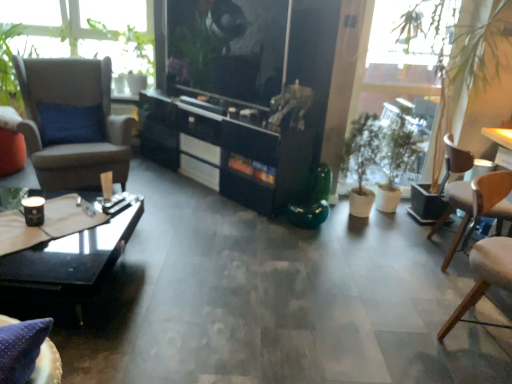
Question: Considering the positions of point (53, 299) and point (386, 185), is point (53, 299) closer or farther from the camera than point (386, 185)?

Choices:
 (A) closer
 (B) farther

Answer: (A)

Question: Do you think black glass coffee table at lower left is within green matte plant at right, or outside of it?

Choices:
 (A) inside
 (B) outside

Answer: (B)

Question: Which object is the closest to the black glossy cabinet at center?

Choices:
 (A) brown leather armchair at left, placed as the 2th chair when sorted from right to left
 (B) light brown wooden chair at right, placed as the 2th chair when sorted from left to right
 (C) green matte plant at right
 (D) wooden table at right
 (E) green matte plant at right

Answer: (C)

Question: Estimate the real-world distances between objects in this image. Which object is closer to the black glossy cabinet at center?

Choices:
 (A) black glass coffee table at lower left
 (B) light brown wooden chair at right, which appears as the first chair when viewed from the right
 (C) green matte plant at right
 (D) brown leather armchair at left, placed as the 2th chair when sorted from right to left
 (E) green matte plant at right

Answer: (E)